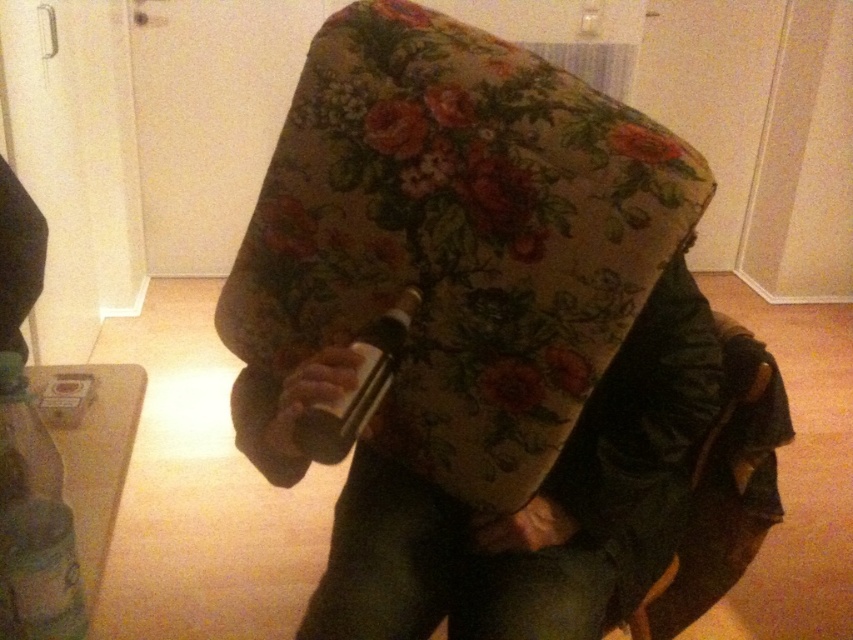
Question: Does translucent plastic bottle at lower left appear over matte plastic bottle at center?

Choices:
 (A) yes
 (B) no

Answer: (B)

Question: Is floral fabric armchair at center to the left of matte plastic bottle at center from the viewer's perspective?

Choices:
 (A) yes
 (B) no

Answer: (B)

Question: Which object appears closest to the camera in this image?

Choices:
 (A) matte plastic bottle at center
 (B) translucent plastic bottle at lower left
 (C) floral fabric armchair at center

Answer: (B)

Question: Which of the following is the closest to the observer?

Choices:
 (A) (465, 244)
 (B) (386, 356)

Answer: (B)

Question: Can you confirm if floral fabric armchair at center is positioned to the right of translucent plastic bottle at lower left?

Choices:
 (A) no
 (B) yes

Answer: (B)

Question: Which object is closer to the camera taking this photo?

Choices:
 (A) matte plastic bottle at center
 (B) translucent plastic bottle at lower left

Answer: (B)